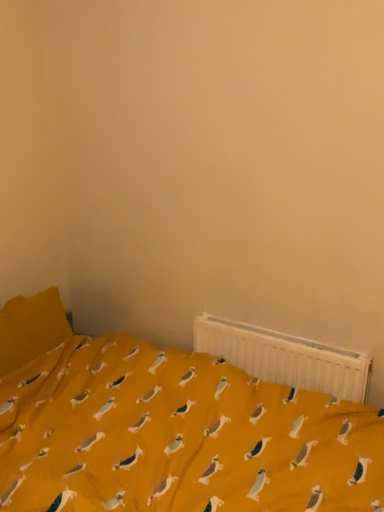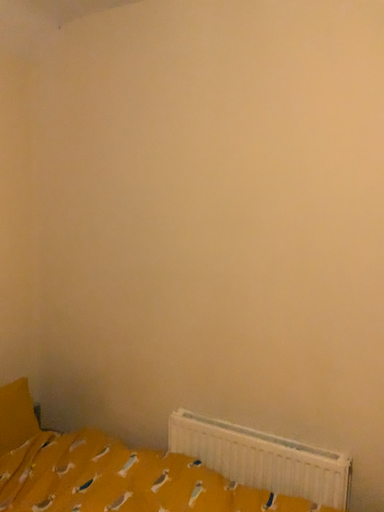
Question: How did the camera likely rotate when shooting the video?

Choices:
 (A) rotated downward
 (B) rotated upward

Answer: (B)